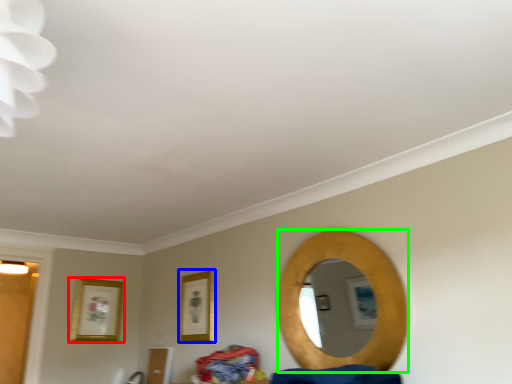
Question: Based on their relative distances, which object is farther from picture frame (highlighted by a red box)? Choose from picture frame (highlighted by a blue box) and mirror (highlighted by a green box).

Choices:
 (A) picture frame
 (B) mirror

Answer: (B)